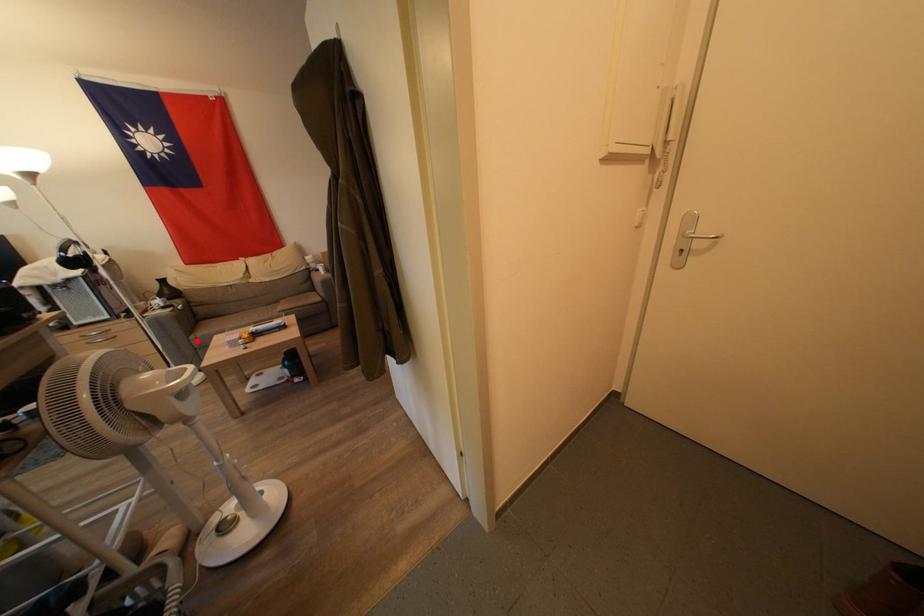
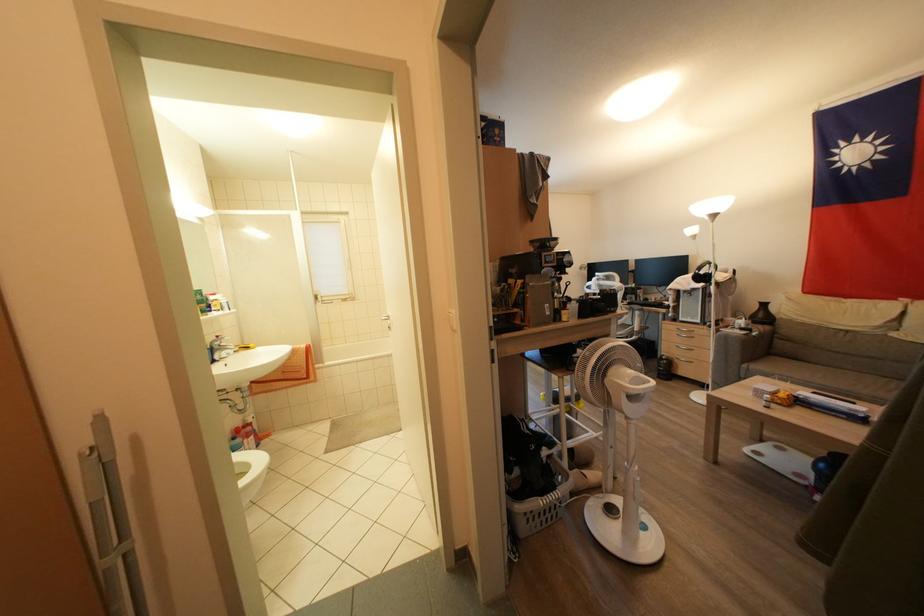
Locate, in the second image, the point that corresponds to the highlighted location in the first image.

(748, 370)